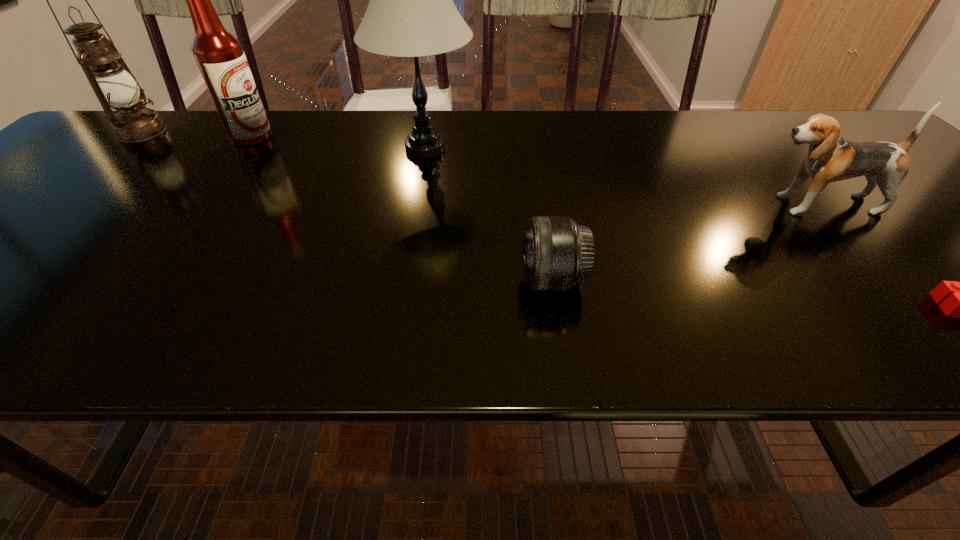
The image size is (960, 540). I want to click on vacant space situated 0.230m at the face of the fourth farthest object, so click(x=647, y=205).

Image resolution: width=960 pixels, height=540 pixels. Find the location of `free space located 0.130m at the face of the fourth farthest object`. free space located 0.130m at the face of the fourth farthest object is located at coordinates (693, 205).

In order to click on free spot located at the face of the fourth farthest object in this screenshot , I will do `click(572, 205)`.

Identify the location of free space located on the front-facing side of the second shortest object. (395, 280).

Where is `vacant space situated on the front-facing side of the second shortest object`? This screenshot has width=960, height=540. vacant space situated on the front-facing side of the second shortest object is located at coordinates (422, 280).

You are a GUI agent. You are given a task and a screenshot of the screen. Output one action in this format:
    pyautogui.click(x=<x>, y=<y>)
    Task: Click on the free space located 0.110m on the front-facing side of the second shortest object
    Image resolution: width=960 pixels, height=540 pixels.
    Given the screenshot: What is the action you would take?
    pyautogui.click(x=461, y=280)

The image size is (960, 540). What are the coordinates of `lamp that is at the far edge` in the screenshot? It's located at (410, 13).

Locate an element on the screen. Image resolution: width=960 pixels, height=540 pixels. alcohol that is at the far edge is located at coordinates (219, 55).

Find the location of a particular element. Image resolution: width=960 pixels, height=540 pixels. oil lamp at the far edge is located at coordinates (115, 86).

Locate an element on the screen. Image resolution: width=960 pixels, height=540 pixels. object located at the left edge is located at coordinates (115, 86).